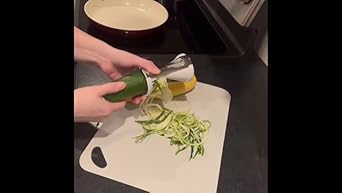
The height and width of the screenshot is (193, 342). I want to click on white cutting board, so click(x=154, y=158).